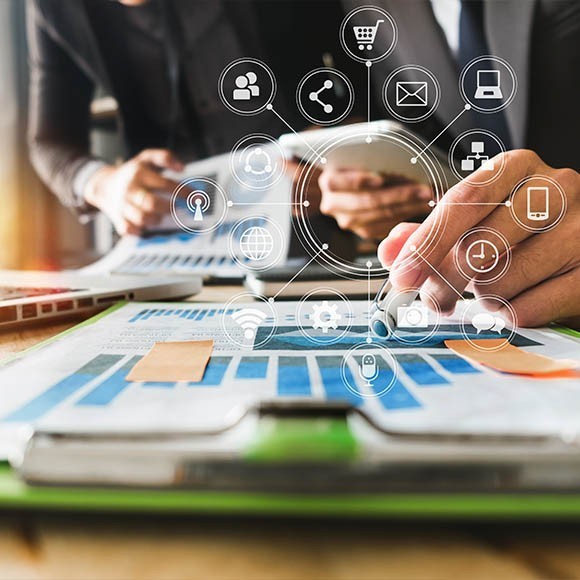
The height and width of the screenshot is (580, 580). I want to click on table, so click(x=195, y=553).